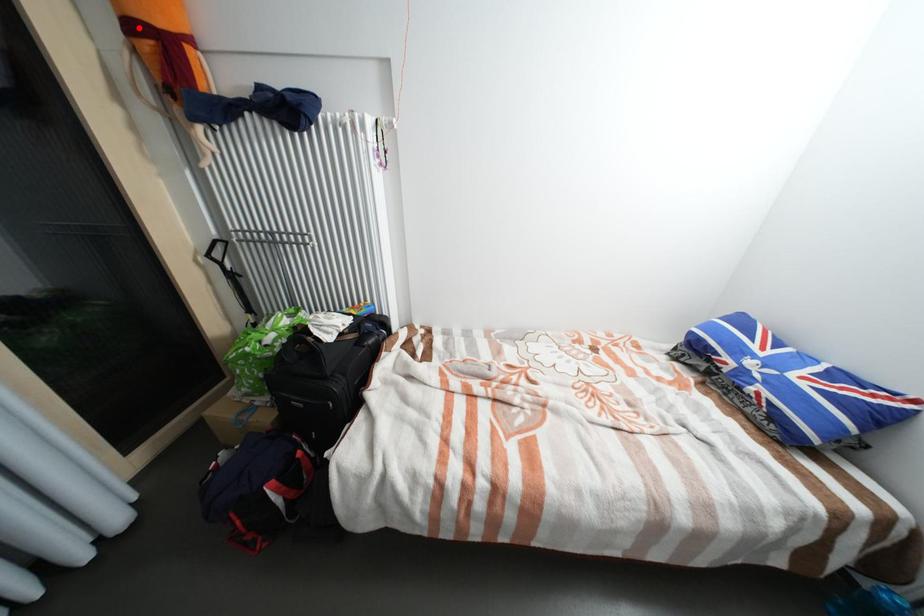
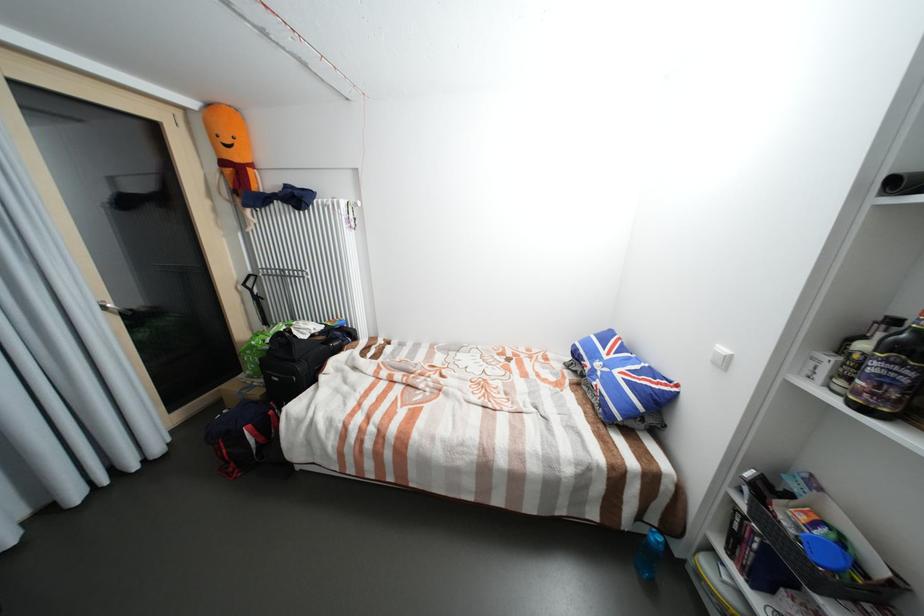
Question: A red point is marked in image1. In image2, is the corresponding 3D point closer to the camera or farther? Reply with the corresponding letter.

Choices:
 (A) The corresponding 3D point is closer.
 (B) The corresponding 3D point is farther.

Answer: (A)